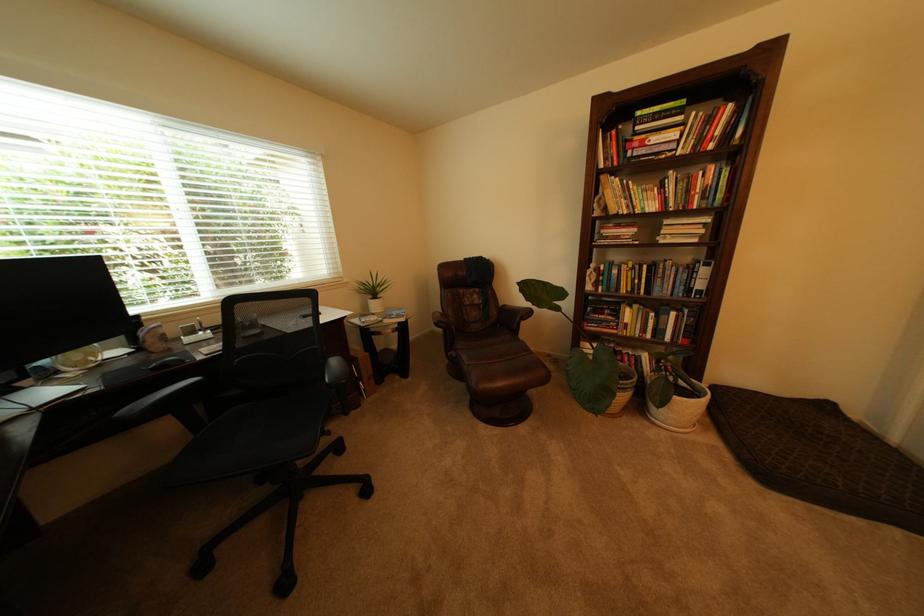
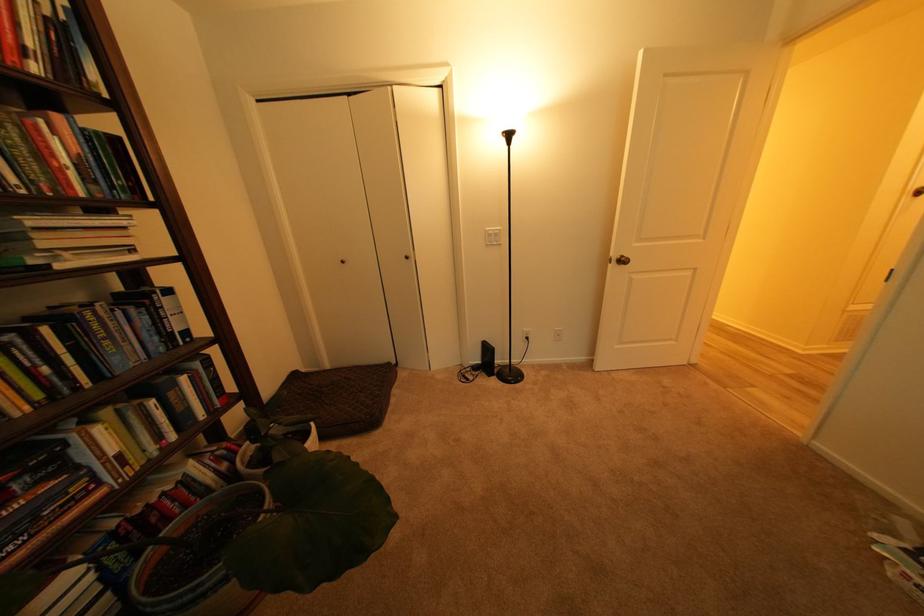
Find the pixel in the second image that matches (x=639, y=331) in the first image.

(141, 463)